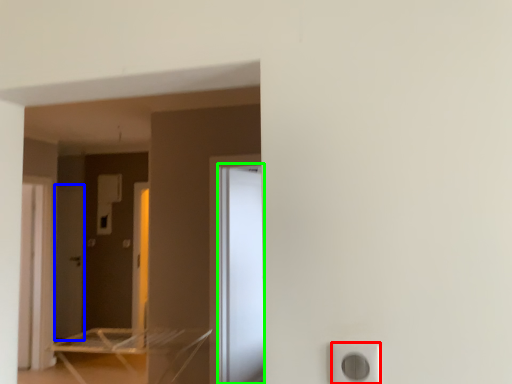
Question: Considering the real-world distances, which object is farthest from electric outlet (highlighted by a red box)? screen door (highlighted by a blue box) or screen door (highlighted by a green box)?

Choices:
 (A) screen door
 (B) screen door

Answer: (A)